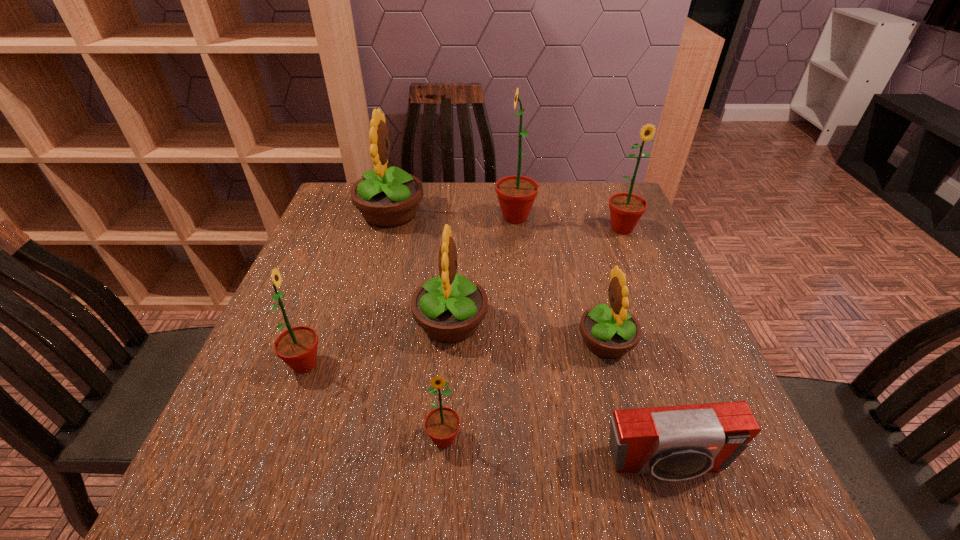
At what (x,y) coordinates should I click in order to perform the action: click on the fifth object from left to right. Please return your answer as a coordinate pair (x, y). Looking at the image, I should click on (516, 194).

This screenshot has width=960, height=540. Find the location of `the third green sunflower from left to right`. the third green sunflower from left to right is located at coordinates (516, 194).

At what (x,y) coordinates should I click in order to perform the action: click on the leftmost yellow sunflower. Please return your answer as a coordinate pair (x, y). Image resolution: width=960 pixels, height=540 pixels. Looking at the image, I should click on (386, 198).

In order to click on the biggest yellow sunflower in this screenshot , I will do `click(386, 198)`.

This screenshot has width=960, height=540. What are the coordinates of `the second biggest green sunflower` in the screenshot? It's located at (626, 209).

I want to click on the rightmost sunflower, so click(x=626, y=209).

Locate an element on the screen. the second yellow sunflower from left to right is located at coordinates (449, 307).

Identify the location of the second nearest green sunflower. (297, 347).

Identify the location of the third biggest green sunflower. Image resolution: width=960 pixels, height=540 pixels. 297,347.

Find the location of a particular element. The width and height of the screenshot is (960, 540). the smallest yellow sunflower is located at coordinates (609, 331).